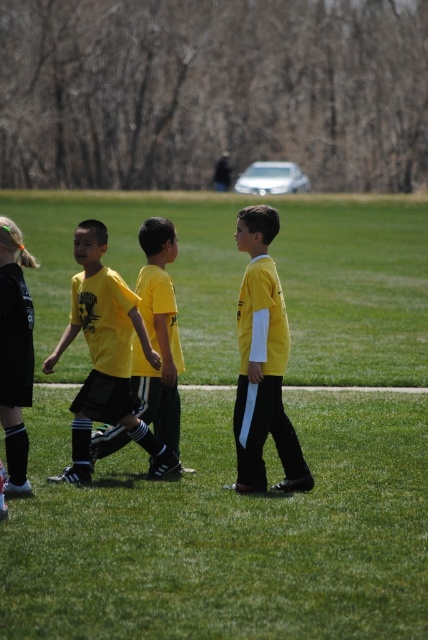
You are a photographer trying to capture a photo of the matte yellow shirt at center and the black matte shorts at lower left. Which object should you focus on first if you want to ensure both are in sharp focus?

The matte yellow shirt at center is positioned under the black matte shorts at lower left. Since the matte yellow shirt at center is closer to the camera, you should focus on it first to ensure both are in sharp focus.

You are a photographer trying to capture a group photo of the children in the grassy field. You notice the matte yellow shirt at center and the black matte shorts at lower left. Which object should you focus on first if you want to ensure both are in focus, considering their sizes?

The matte yellow shirt at center is bigger than the black matte shorts at lower left. Since the matte yellow shirt at center is larger, it requires more focus area, so you should focus on it first to ensure both are in focus.